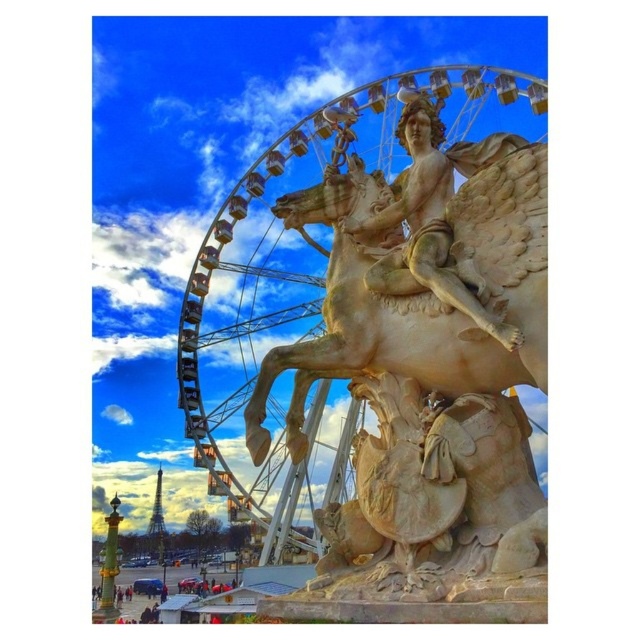
You are standing in the public square and want to take a photo of both the metallic ferris wheel at center and the polished stone statue at center. Which object will appear closer to you in the photo?

The metallic ferris wheel at center will appear closer to you in the photo because it is positioned further to the viewer than the polished stone statue at center.

You are an architect planning to install a new sculpture in the square. The sculpture will be placed between the metallic ferris wheel at center and the polished stone statue at center. Which object should the sculpture be closer to if it needs to appear proportionally balanced with the existing structures?

The sculpture should be placed closer to the polished stone statue at center because the metallic ferris wheel at center is larger in size, so balancing the sculpture closer to the smaller statue would create a harmonious proportion between the three structures.

You are standing at the center of the square and want to take a photo of the metallic ferris wheel at center. Based on its coordinates, where should you aim your camera?

You should aim your camera at point 0.442 on the x axis and 0.473 on the y axis to capture the metallic ferris wheel at center.